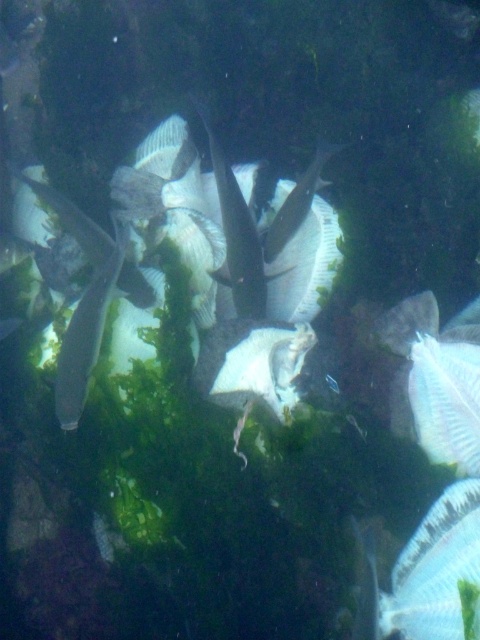
Question: Can you confirm if translucent white fish at lower right is wider than silvery metallic fish at left?

Choices:
 (A) yes
 (B) no

Answer: (A)

Question: Is translucent white fish at lower right above silvery metallic fish at left?

Choices:
 (A) yes
 (B) no

Answer: (B)

Question: Is translucent white fish at lower right bigger than silvery metallic fish at left?

Choices:
 (A) yes
 (B) no

Answer: (B)